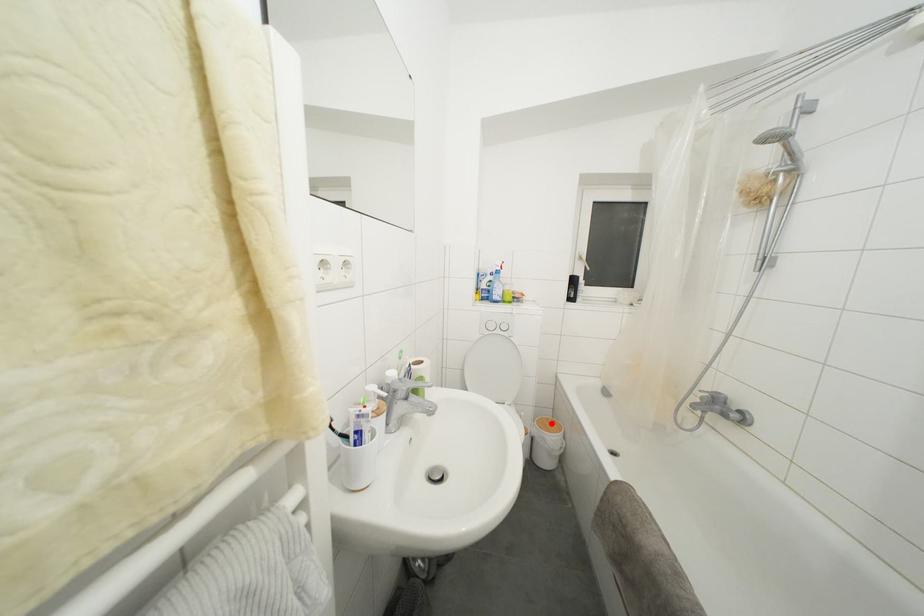
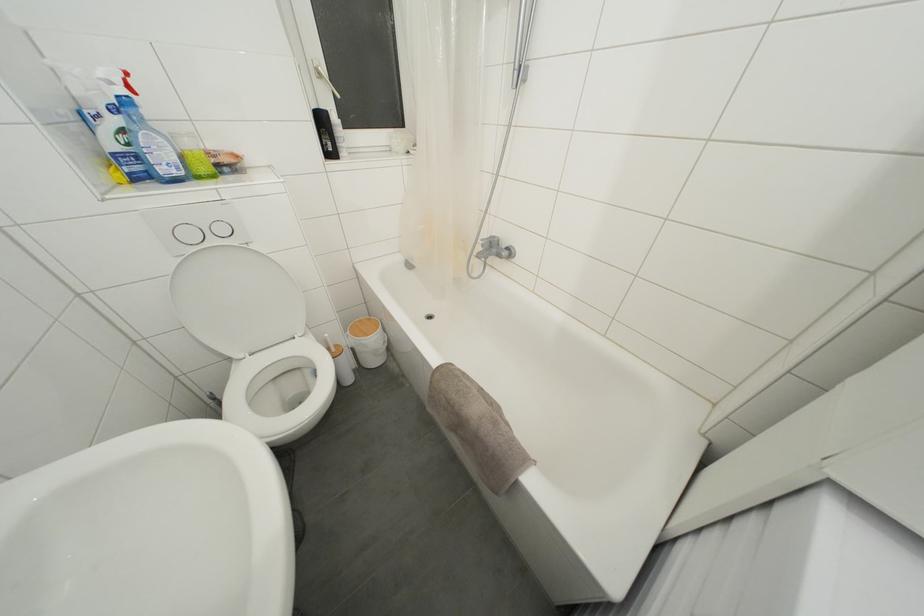
Question: I am providing you with two images of the same scene from different viewpoints. Image1 has a red point marked. In image2, the corresponding 3D location appears at what relative position? Reply with the corresponding letter.

Choices:
 (A) Closer
 (B) Farther

Answer: (A)